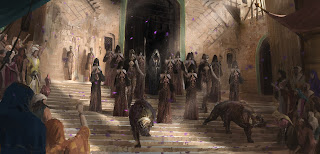
Find the location of a particular element. This screenshot has height=154, width=320. stairs is located at coordinates (69, 93).